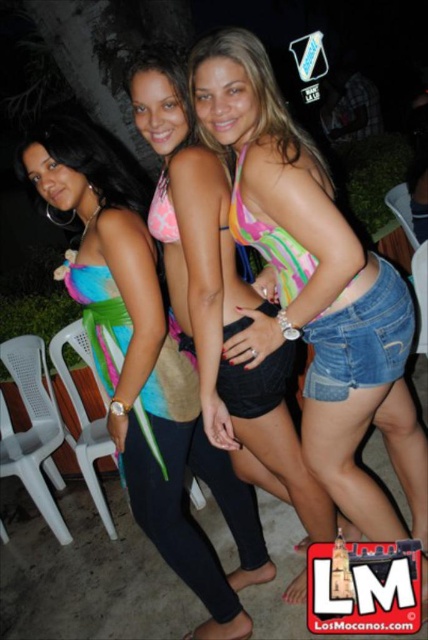
You are a photographer adjusting your camera settings to focus on two specific points in the image. The first point is at coordinates point (303, 426), and the second is at point (261, 541). Which point should you focus on first if you want to ensure both points are in focus?

You should focus on point (303, 426) first because it is closer to the camera than point (261, 541). By focusing on the closer point, the farther point will also be within the depth of field, ensuring both are in focus.